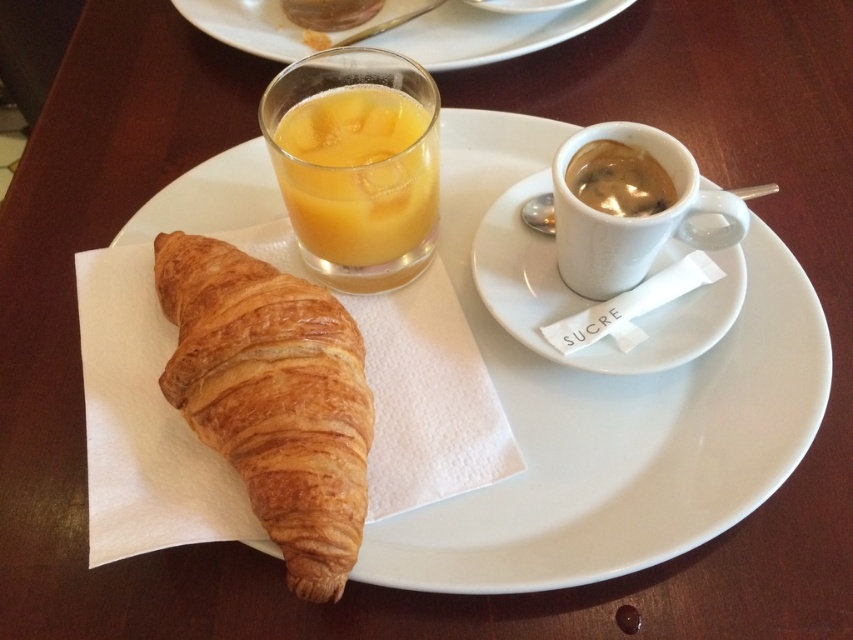
Question: Which object appears closest to the camera in this image?

Choices:
 (A) brown matte cup at upper right
 (B) translucent glass orange juice at center
 (C) white ceramic saucer at upper center
 (D) white glossy cup at upper right

Answer: (D)

Question: Observing the image, what is the correct spatial positioning of golden brown flaky croissant at left in reference to white glossy cup at upper right?

Choices:
 (A) above
 (B) below

Answer: (B)

Question: Which object appears farthest from the camera in this image?

Choices:
 (A) golden brown flaky croissant at left
 (B) translucent glass orange juice at center
 (C) white ceramic plate at center

Answer: (B)

Question: Does white ceramic plate at center appear under white ceramic saucer at upper center?

Choices:
 (A) no
 (B) yes

Answer: (B)

Question: Among these objects, which one is nearest to the camera?

Choices:
 (A) white glossy cup at upper right
 (B) matte glass at upper center
 (C) white ceramic saucer at upper center
 (D) translucent glass orange juice at center

Answer: (A)

Question: Is matte glass at upper center positioned behind white glossy cup at upper right?

Choices:
 (A) yes
 (B) no

Answer: (A)